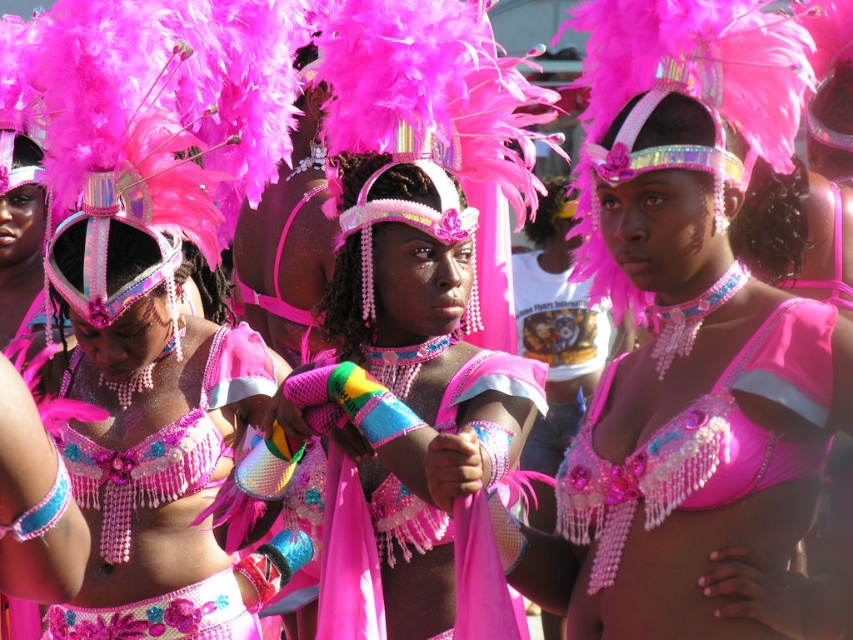
Question: Among these objects, which one is farthest from the camera?

Choices:
 (A) matte pink bikini at center
 (B) shiny pink bikini top at center

Answer: (B)

Question: Is matte pink bikini at center to the left of pink beaded bikini top at center from the viewer's perspective?

Choices:
 (A) no
 (B) yes

Answer: (A)

Question: Can you confirm if matte pink bikini at center is positioned below shiny pink bikini top at center?

Choices:
 (A) no
 (B) yes

Answer: (A)

Question: Estimate the real-world distances between objects in this image. Which object is farther from the matte pink bikini at center?

Choices:
 (A) shiny pink bikini top at center
 (B) pink beaded bikini top at center

Answer: (B)

Question: Is matte pink bikini at center to the right of pink beaded bikini top at center from the viewer's perspective?

Choices:
 (A) yes
 (B) no

Answer: (A)

Question: Which point is farther to the camera?

Choices:
 (A) matte pink bikini at center
 (B) shiny pink bikini top at center

Answer: (B)